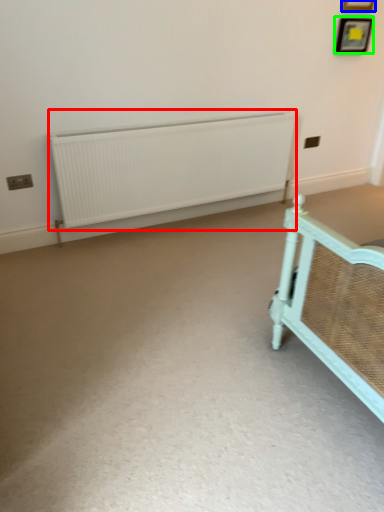
Question: Which object is the closest to the radiator (highlighted by a red box)? Choose among these: picture frame (highlighted by a blue box) or picture frame (highlighted by a green box).

Choices:
 (A) picture frame
 (B) picture frame

Answer: (B)